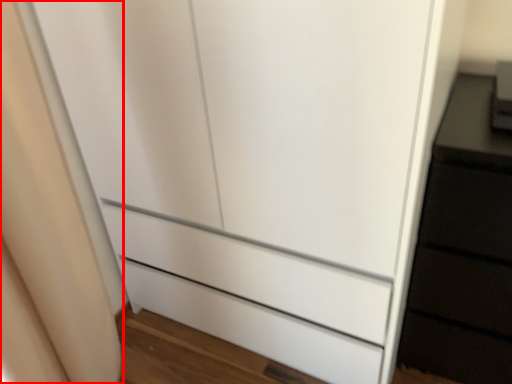
Question: Where is curtain (annotated by the red box) located in relation to appliance in the image?

Choices:
 (A) right
 (B) left

Answer: (B)